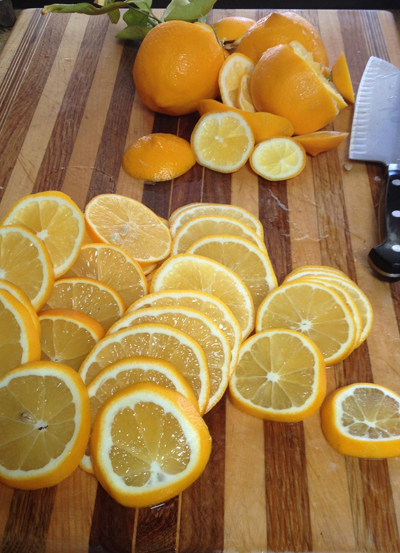
Identify the location of light brown section of cutting board. (71, 514), (232, 516), (335, 518), (385, 317).